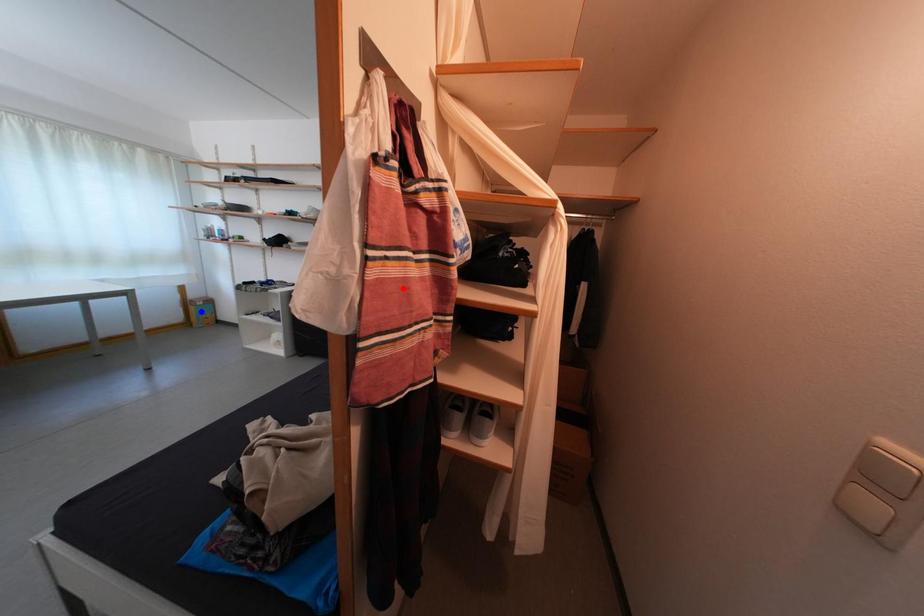
Question: In the image, two points are highlighted. Which point is nearer to the camera? Reply with the corresponding letter.

Choices:
 (A) blue point
 (B) red point

Answer: (B)